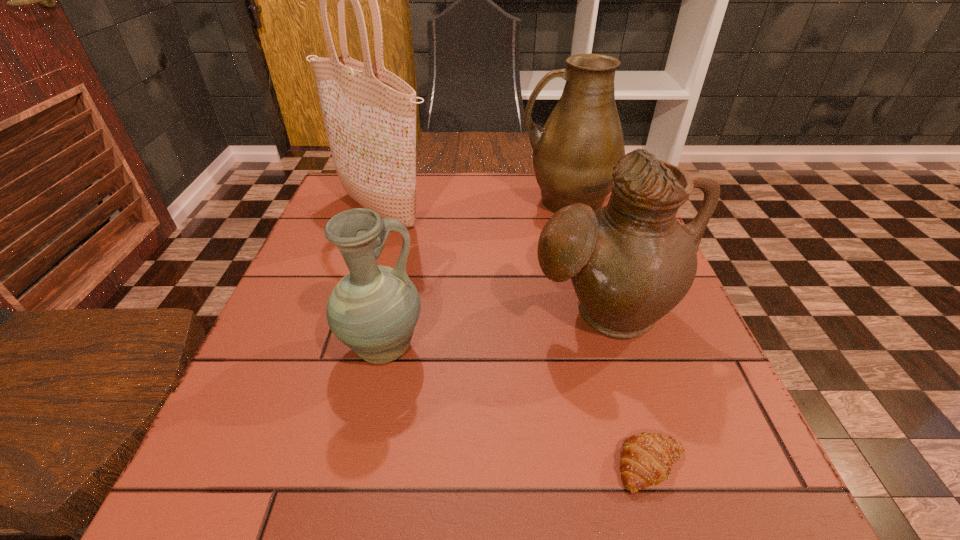
I want to click on the tallest object, so click(x=369, y=113).

This screenshot has width=960, height=540. Find the location of `the farthest pitcher`. the farthest pitcher is located at coordinates (574, 153).

Identify the location of the leftmost pitcher. This screenshot has height=540, width=960. (373, 310).

You are a GUI agent. You are given a task and a screenshot of the screen. Output one action in this format:
    pyautogui.click(x=<x>, y=<y>)
    Task: Click on the shortest pitcher
    The height and width of the screenshot is (540, 960).
    Given the screenshot: What is the action you would take?
    pyautogui.click(x=373, y=310)

The image size is (960, 540). Identify the location of the nearest object. (646, 459).

Locate an element on the screen. This screenshot has height=540, width=960. the shortest object is located at coordinates (646, 459).

Identify the location of free location located on the front of the tallest object. This screenshot has width=960, height=540. (348, 319).

The height and width of the screenshot is (540, 960). Identify the location of vacant space located 0.200m on the handle side of the farthest pitcher. (444, 202).

I want to click on free location located 0.370m on the handle side of the farthest pitcher, so click(378, 202).

The width and height of the screenshot is (960, 540). Find the location of `vacant space located 0.080m on the handle side of the farthest pitcher`. vacant space located 0.080m on the handle side of the farthest pitcher is located at coordinates (489, 202).